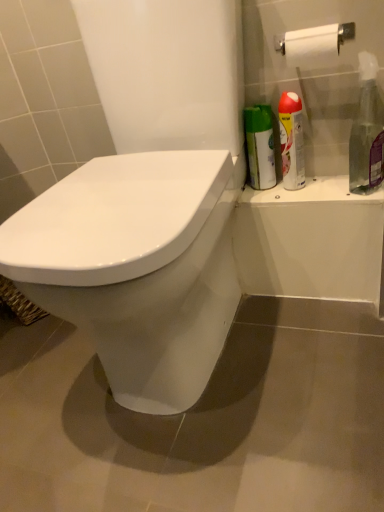
Locate an element on the screen. Image resolution: width=384 pixels, height=512 pixels. vacant space to the left of clear plastic spray bottle at right, marked as the 2th cleaning product in a left-to-right arrangement is located at coordinates (324, 196).